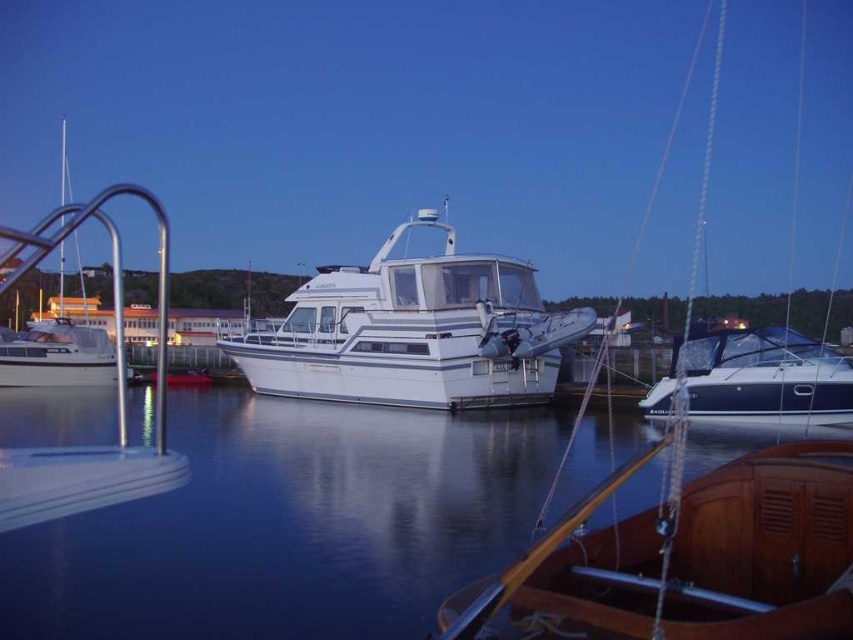
You are a photographer planning to capture the reflection of the white glossy boat at left in the smooth water at center. Based on the scene description, will the entire boat fit within the width of the water surface? Explain your reasoning using the provided details.

The smooth water at center has a lesser width compared to white glossy boat at left, meaning the water surface is narrower than the boat. Therefore, the entire boat cannot fit within the width of the water surface for the reflection.

You are standing at the edge of the marina, looking out at the white motor yacht with the attached dinghy. There is a specific point marked at coordinates point (350, 538) that you need to reach. Can you safely walk towards this point from your current position without entering the water?

The point (350, 538) is 8.18 meters away from the viewer. Since the marina edge is solid ground and the water is calm, you can safely walk towards the point as long as you stay on the marina edge and do not step into the water.

You are a boat operator who needs to dock your vessel. You see the white glossy boat at center and the blue glossy sailboat at right in the marina. Can you safely maneuver your 25 feet long boat between them without touching either?

The distance between the white glossy boat at center and the blue glossy sailboat at right is 23.44 feet. Since your boat is 25 feet long, it is slightly longer than the available space. Maneuvering between them without touching might be challenging and risky. It is recommended to choose a different path or ensure precise control to avoid collision.